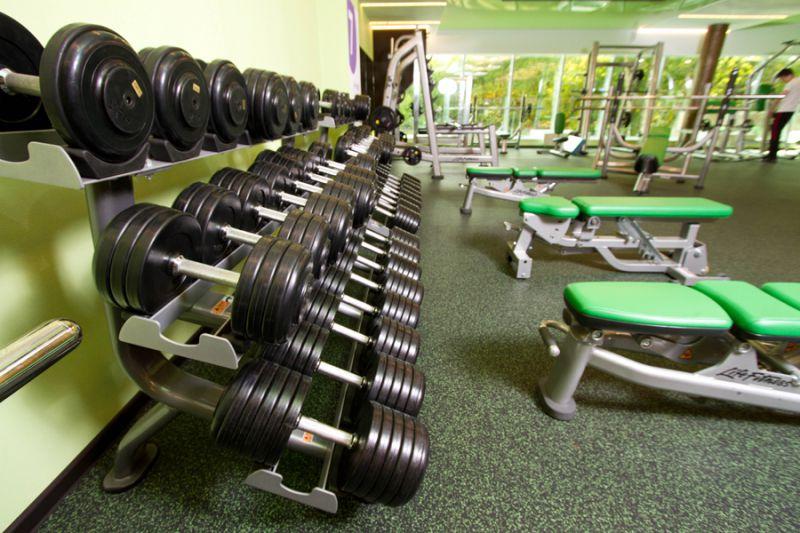
Find the location of a particular element. window is located at coordinates (433, 66), (488, 62), (526, 67), (564, 67), (640, 69), (673, 70), (722, 66), (777, 63).